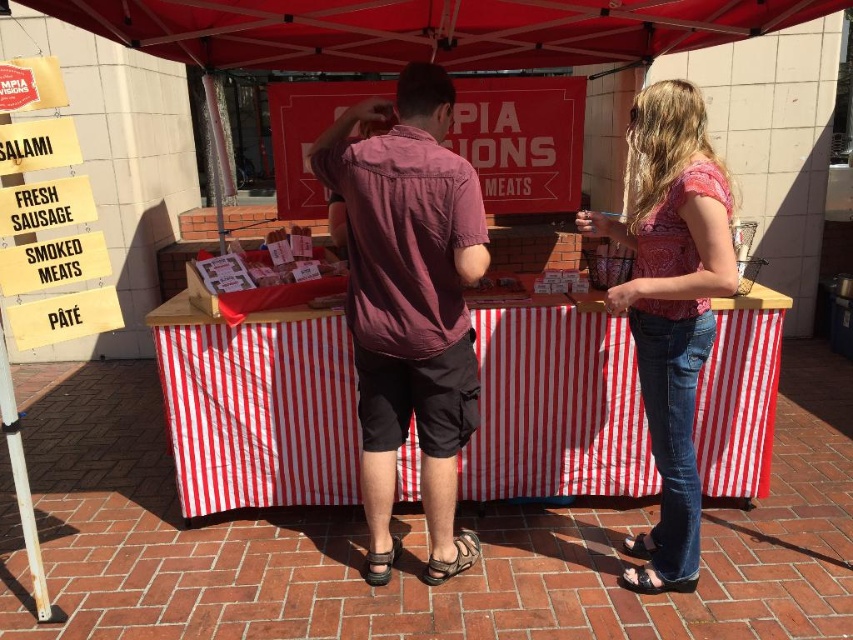
Question: In this image, where is maroon cotton shirt at center located relative to pink floral blouse at center?

Choices:
 (A) right
 (B) left

Answer: (B)

Question: Can you confirm if maroon cotton shirt at center is positioned to the right of pink floral blouse at center?

Choices:
 (A) no
 (B) yes

Answer: (A)

Question: Which object is the closest to the red fabric canopy at upper center?

Choices:
 (A) pink floral blouse at center
 (B) maroon cotton shirt at center
 (C) matte pink shirt at center

Answer: (C)

Question: Estimate the real-world distances between objects in this image. Which object is closer to the pink floral blouse at center?

Choices:
 (A) red fabric canopy at upper center
 (B) maroon cotton shirt at center
 (C) matte pink shirt at center

Answer: (C)

Question: Which object appears farthest from the camera in this image?

Choices:
 (A) matte pink shirt at center
 (B) red fabric canopy at upper center
 (C) pink floral blouse at center
 (D) maroon cotton shirt at center

Answer: (B)

Question: Can you confirm if matte pink shirt at center is thinner than pink floral blouse at center?

Choices:
 (A) yes
 (B) no

Answer: (B)